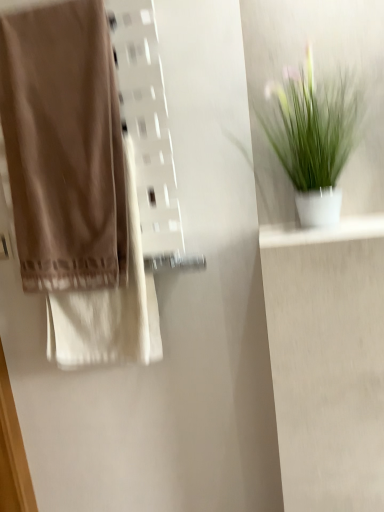
Question: Considering the relative positions of green matte plant at upper right and white glossy shelf at upper right in the image provided, is green matte plant at upper right to the left or to the right of white glossy shelf at upper right?

Choices:
 (A) right
 (B) left

Answer: (B)

Question: From the image's perspective, is green matte plant at upper right positioned above or below white glossy shelf at upper right?

Choices:
 (A) below
 (B) above

Answer: (B)

Question: Based on their relative distances, which object is farther from the white glossy shelf at upper right?

Choices:
 (A) matte brown towel at left
 (B) green matte plant at upper right

Answer: (A)

Question: Estimate the real-world distances between objects in this image. Which object is closer to the matte brown towel at left?

Choices:
 (A) green matte plant at upper right
 (B) white glossy shelf at upper right

Answer: (A)